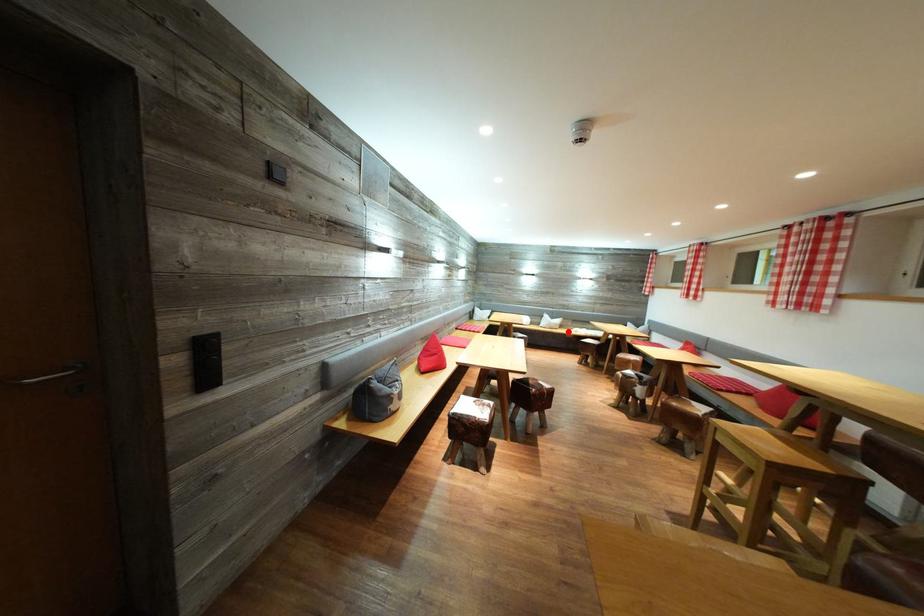
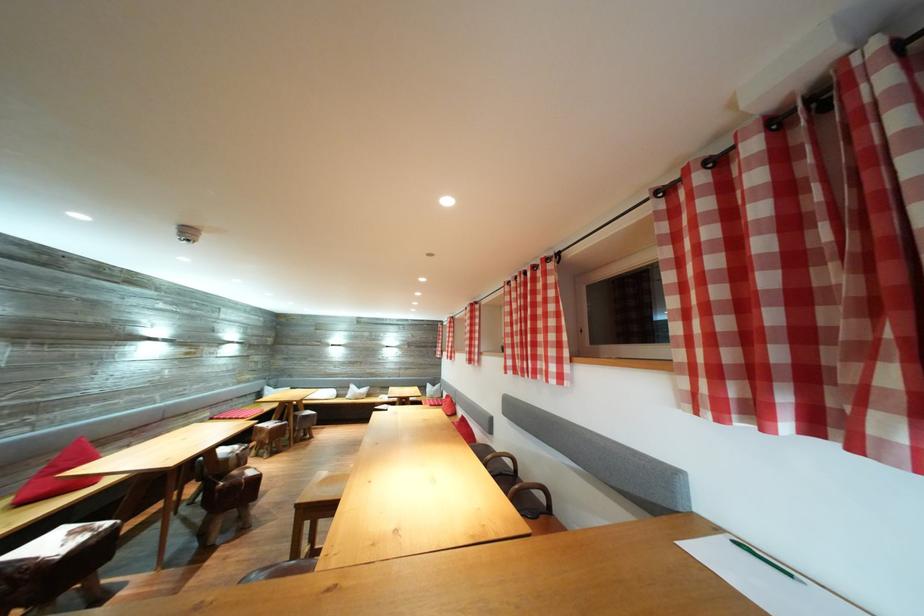
Question: I am providing you with two images of the same scene from different viewpoints. Image1 has a red point marked. In image2, the corresponding 3D location appears at what relative position? Reply with the corresponding letter.

Choices:
 (A) Closer
 (B) Farther

Answer: (B)